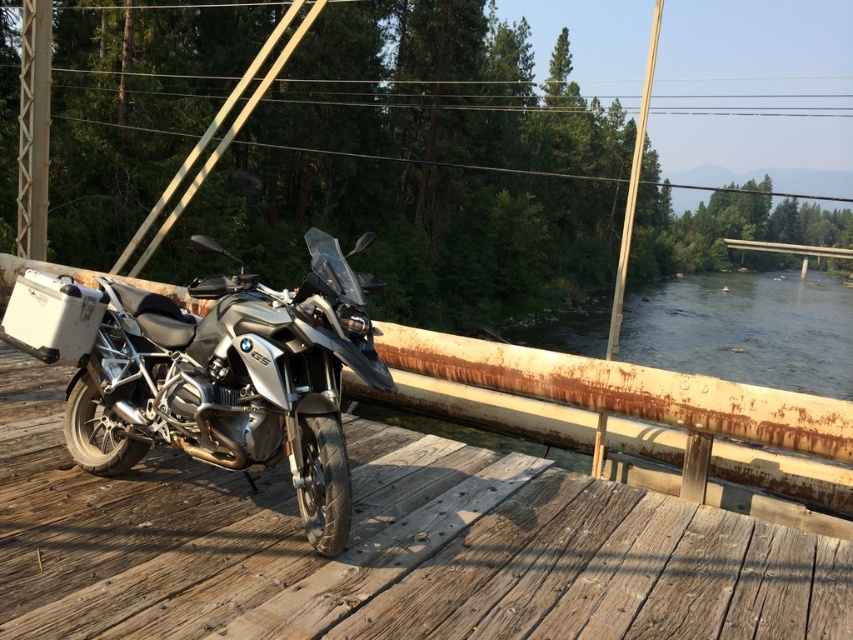
Question: Can you confirm if silver metallic motorcycle at center is positioned to the left of brushed metal pole at upper left?

Choices:
 (A) no
 (B) yes

Answer: (A)

Question: In this image, where is wooden deck at center located relative to silver metallic motorcycle at center?

Choices:
 (A) below
 (B) above

Answer: (A)

Question: Among these objects, which one is farthest from the camera?

Choices:
 (A) wooden deck at center
 (B) brushed metal pole at upper left
 (C) silver metallic motorcycle at center

Answer: (B)

Question: Which object is closer to the camera taking this photo?

Choices:
 (A) brushed metal pole at upper left
 (B) wooden deck at center
 (C) silver metallic motorcycle at center

Answer: (B)

Question: Does silver metallic motorcycle at center appear on the right side of brushed metal pole at upper left?

Choices:
 (A) yes
 (B) no

Answer: (A)

Question: Estimate the real-world distances between objects in this image. Which object is farther from the wooden deck at center?

Choices:
 (A) brushed metal pole at upper left
 (B) silver metallic motorcycle at center

Answer: (A)